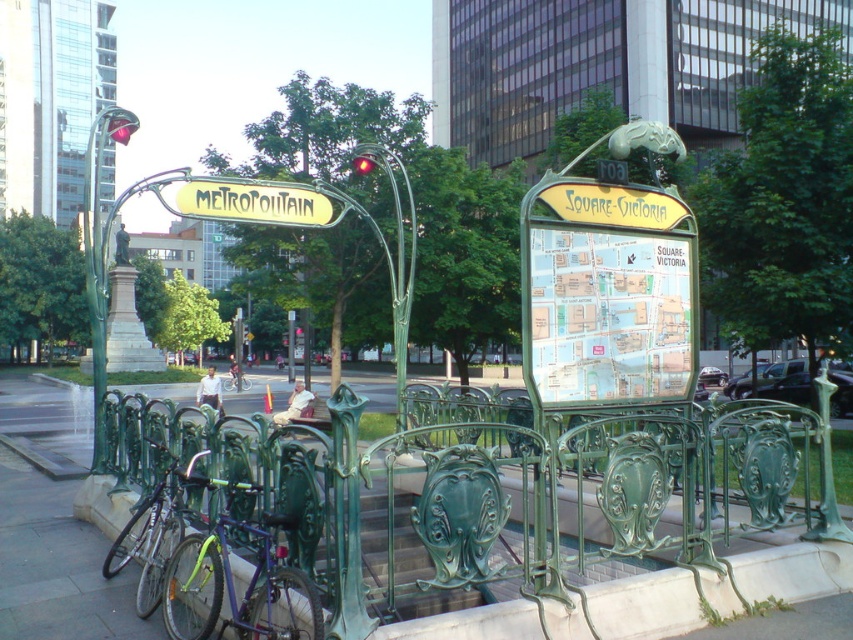
Question: Is yellow metallic signboard at center positioned at the back of green matte bicycle at center?

Choices:
 (A) yes
 (B) no

Answer: (B)

Question: Which of these objects is positioned farthest from the green wrought iron fence at center?

Choices:
 (A) green matte bicycle at center
 (B) purple matte bicycle at center

Answer: (A)

Question: Which of the following is the closest to the observer?

Choices:
 (A) (109, 138)
 (B) (320, 608)
 (C) (682, 476)

Answer: (B)

Question: Does purple matte bicycle at center lie in front of green matte bicycle at lower left?

Choices:
 (A) no
 (B) yes

Answer: (B)

Question: Does purple matte bicycle at center have a greater width compared to yellow metallic signboard at center?

Choices:
 (A) no
 (B) yes

Answer: (A)

Question: Which point is farther to the camera?

Choices:
 (A) (207, 179)
 (B) (161, 524)
 (C) (115, 108)
 (D) (241, 385)

Answer: (D)